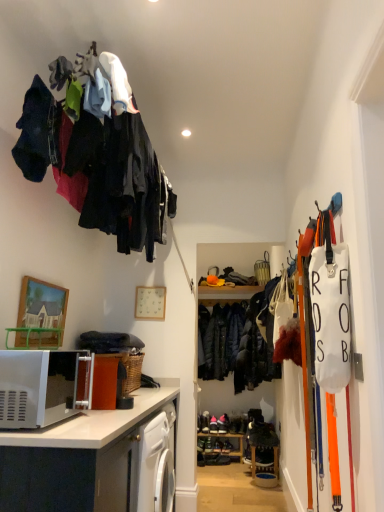
The image size is (384, 512). What are the coordinates of `dark blue quilted jacket at center, placed as the second clothing when sorted from front to back` in the screenshot? It's located at (219, 339).

How much space does dark blue fabric at upper left, the 2th clothing in the back-to-front sequence, occupy vertically?

32.09 inches.

What is the approximate width of wooden shelf at lower center?

The width of wooden shelf at lower center is 10.40 inches.

Describe the element at coordinates (213, 425) in the screenshot. I see `dark brown leather shoes at center, which ranks as the 2th footwear in right-to-left order` at that location.

Where is `black leather shoes at center, positioned as the 2th footwear in left-to-right order`? Image resolution: width=384 pixels, height=512 pixels. black leather shoes at center, positioned as the 2th footwear in left-to-right order is located at coordinates (223, 423).

From the image's perspective, is dark blue fabric at upper left, positioned as the 2th clothing in bottom-to-top order, on wooden shelf at lower center?

Correct, dark blue fabric at upper left, positioned as the 2th clothing in bottom-to-top order, appears higher than wooden shelf at lower center in the image.

What's the angular difference between dark blue fabric at upper left, acting as the 1th clothing starting from the top, and wooden shelf at lower center's facing directions?

91.7 degrees separate the facing orientations of dark blue fabric at upper left, acting as the 1th clothing starting from the top, and wooden shelf at lower center.

Which of these two, dark blue fabric at upper left, acting as the 1th clothing starting from the left, or wooden shelf at lower center, stands taller?

With more height is dark blue fabric at upper left, acting as the 1th clothing starting from the left.

Are black leather shoes at center, which is the first footwear from right to left, and wooden picture frame at upper left beside each other?

No, black leather shoes at center, which is the first footwear from right to left, is not beside wooden picture frame at upper left.

From a real-world perspective, who is located higher, black leather shoes at center, which is the first footwear from right to left, or wooden picture frame at upper left?

wooden picture frame at upper left.

In the scene shown: From the image's perspective, is black leather shoes at center, which is the first footwear from right to left, below wooden picture frame at upper left?

Yes, from the image's perspective, black leather shoes at center, which is the first footwear from right to left, is below wooden picture frame at upper left.

Is black leather shoes at center, which is the first footwear from right to left, oriented towards white matte microwave at lower left?

Yes, black leather shoes at center, which is the first footwear from right to left, faces towards white matte microwave at lower left.

Which is behind, point (218, 426) or point (44, 368)?

The point (218, 426) is more distant.

From the picture: Considering the sizes of black leather shoes at center, positioned as the 2th footwear in left-to-right order, and white matte microwave at lower left in the image, is black leather shoes at center, positioned as the 2th footwear in left-to-right order, wider or thinner than white matte microwave at lower left?

Clearly, black leather shoes at center, positioned as the 2th footwear in left-to-right order, has less width compared to white matte microwave at lower left.

From the image's perspective, is black leather shoes at center, positioned as the 2th footwear in left-to-right order, located beneath white matte microwave at lower left?

Yes.

Does dark blue fabric at upper left, acting as the 1th clothing starting from the top, have a smaller size compared to wooden picture frame at upper left?

No.

Based on the photo, does dark blue fabric at upper left, positioned as the 2th clothing in bottom-to-top order, turn towards wooden picture frame at upper left?

No.

From the image's perspective, which one is positioned lower, dark blue fabric at upper left, acting as the 1th clothing starting from the top, or wooden picture frame at upper left?

wooden picture frame at upper left, from the image's perspective.

Considering the relative positions of dark blue fabric at upper left, positioned as the 2th clothing in bottom-to-top order, and wooden picture frame at upper left in the image provided, is dark blue fabric at upper left, positioned as the 2th clothing in bottom-to-top order, behind wooden picture frame at upper left?

No, dark blue fabric at upper left, positioned as the 2th clothing in bottom-to-top order, is closer to the camera.

Is point (212, 428) positioned before point (242, 451)?

No, (212, 428) is further to viewer.

Is dark brown leather shoes at center, which is the 1th footwear in left-to-right order, oriented towards wooden shelf at lower center?

No, dark brown leather shoes at center, which is the 1th footwear in left-to-right order, is not turned towards wooden shelf at lower center.

From a real-world perspective, is dark brown leather shoes at center, which is the 1th footwear in left-to-right order, located beneath wooden shelf at lower center?

No, from a real-world perspective, dark brown leather shoes at center, which is the 1th footwear in left-to-right order, is not beneath wooden shelf at lower center.

Does dark brown leather shoes at center, which is the 1th footwear in left-to-right order, have a smaller size compared to wooden shelf at lower center?

Correct, dark brown leather shoes at center, which is the 1th footwear in left-to-right order, occupies less space than wooden shelf at lower center.

Does point (108, 461) lie in front of point (198, 445)?

Yes, it is.

Is the position of white glossy microwave at lower left less distant than that of wooden shelf at lower center?

Yes, white glossy microwave at lower left is closer to the viewer.

Where is `shelf lying behind the white glossy microwave at lower left`? This screenshot has width=384, height=512. shelf lying behind the white glossy microwave at lower left is located at coordinates (221, 444).

Is white matte microwave at lower left bigger than wooden picture frame at upper left?

Yes.

How many degrees apart are the facing directions of white matte microwave at lower left and wooden picture frame at upper left?

0.383 degrees.

Image resolution: width=384 pixels, height=512 pixels. I want to click on microwave oven on the right of wooden picture frame at upper left, so click(x=37, y=387).

Is white matte microwave at lower left to the right of wooden picture frame at upper left from the viewer's perspective?

Correct, you'll find white matte microwave at lower left to the right of wooden picture frame at upper left.

Locate an element on the screen. This screenshot has width=384, height=512. clothing on the left of wooden shelf at lower center is located at coordinates 97,151.

The image size is (384, 512). I want to click on the 2nd footwear positioned below the wooden picture frame at upper left (from a real-world perspective), so pos(223,423).

Estimate the real-world distances between objects in this image. Which object is closer to white glossy microwave at lower left, wooden picture frame at upper left or dark brown leather shoes at center, which ranks as the 2th footwear in right-to-left order?

wooden picture frame at upper left.

Which object lies further to the anchor point dark brown leather shoes at center, which is the 1th footwear in left-to-right order, white matte microwave at lower left or dark blue fabric at upper left, placed as the 2th clothing when sorted from right to left?

Based on the image, dark blue fabric at upper left, placed as the 2th clothing when sorted from right to left, appears to be further to dark brown leather shoes at center, which is the 1th footwear in left-to-right order.

Consider the image. From the image, which object appears to be farther from white matte microwave at lower left, wooden picture frame at upper left or dark blue quilted jacket at center, placed as the first clothing when sorted from right to left?

dark blue quilted jacket at center, placed as the first clothing when sorted from right to left, is positioned further to the anchor white matte microwave at lower left.

Considering their positions, is dark blue quilted jacket at center, which appears as the second clothing when viewed from the left, positioned closer to dark brown leather shoes at center, which ranks as the 2th footwear in right-to-left order, than wooden shelf at lower center?

wooden shelf at lower center lies closer to dark brown leather shoes at center, which ranks as the 2th footwear in right-to-left order, than the other object.

Based on their spatial positions, is dark blue quilted jacket at center, which is counted as the 1th clothing, starting from the back, or white matte microwave at lower left further from dark brown leather shoes at center, which is the 1th footwear in left-to-right order?

white matte microwave at lower left.

Considering their positions, is dark blue quilted jacket at center, positioned as the 2th clothing in top-to-bottom order, positioned closer to white matte microwave at lower left than white glossy microwave at lower left?

white glossy microwave at lower left.

Looking at the image, which one is located further to wooden shelf at lower center, dark blue quilted jacket at center, placed as the first clothing when sorted from right to left, or dark blue fabric at upper left, the 2th clothing in the back-to-front sequence?

dark blue fabric at upper left, the 2th clothing in the back-to-front sequence.

Based on their spatial positions, is dark blue fabric at upper left, positioned as the 2th clothing in bottom-to-top order, or dark blue quilted jacket at center, placed as the first clothing when sorted from right to left, further from wooden shelf at lower center?

dark blue fabric at upper left, positioned as the 2th clothing in bottom-to-top order.

At what (x,y) coordinates should I click in order to perform the action: click on shelf located between wooden picture frame at upper left and black leather shoes at center, which is the first footwear from right to left, in the depth direction. Please return your answer as a coordinate pair (x, y). The image size is (384, 512). Looking at the image, I should click on (221, 444).

Find the location of a particular element. The image size is (384, 512). clothing located between wooden picture frame at upper left and dark brown leather shoes at center, which ranks as the 2th footwear in right-to-left order, in the depth direction is located at coordinates (219, 339).

Image resolution: width=384 pixels, height=512 pixels. I want to click on shelf located between white glossy microwave at lower left and black leather shoes at center, which is the first footwear from right to left, in the depth direction, so click(221, 444).

Identify the location of shelf between white matte microwave at lower left and black leather shoes at center, which is the first footwear from right to left, in the front-back direction. The height and width of the screenshot is (512, 384). (221, 444).